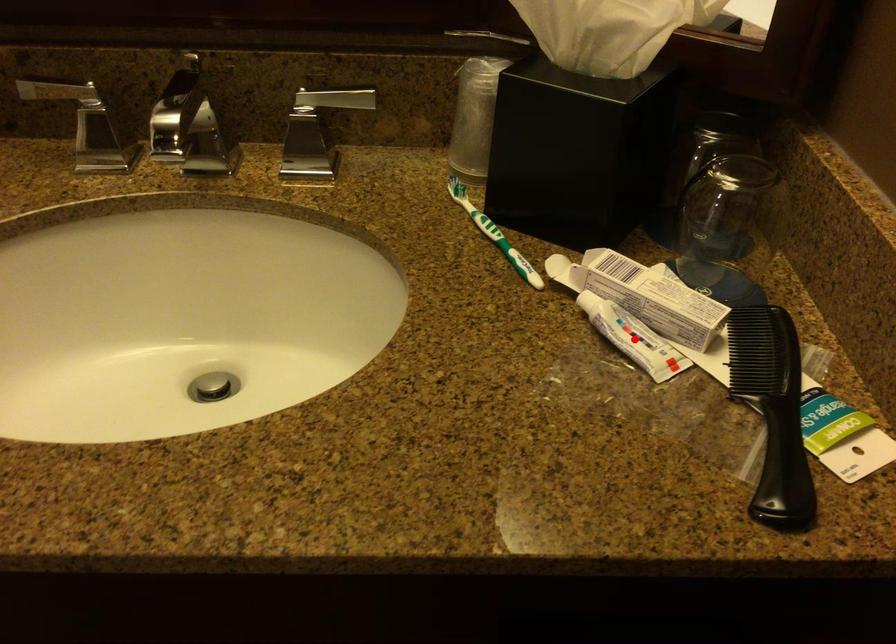
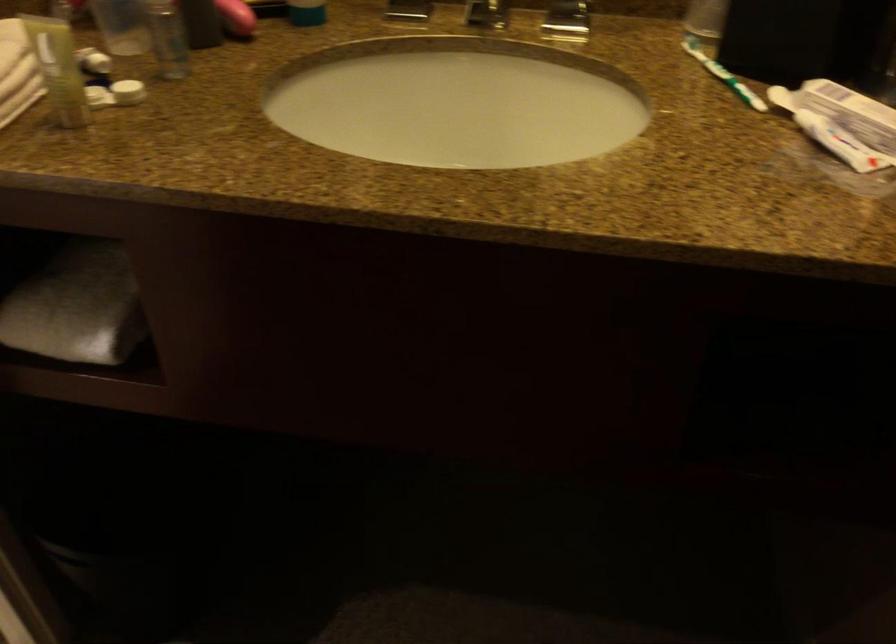
Where in the second image is the point corresponding to the highlighted location from the first image?

(840, 143)